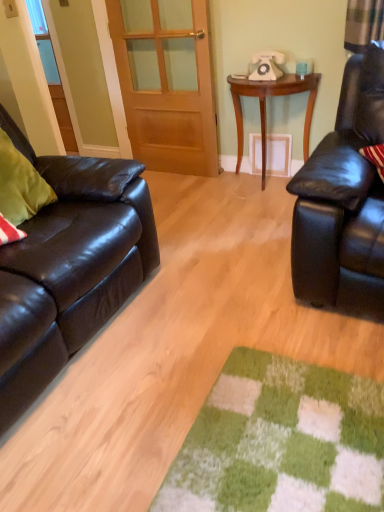
Question: Looking at their shapes, would you say shiny black leather couch at left is wider or thinner than wooden door at center?

Choices:
 (A) thin
 (B) wide

Answer: (B)

Question: Is shiny black leather couch at left taller or shorter than wooden door at center?

Choices:
 (A) tall
 (B) short

Answer: (B)

Question: Estimate the real-world distances between objects in this image. Which object is closer to the wooden table at center?

Choices:
 (A) wooden door at center
 (B) shiny black leather couch at left
 (C) matte black leather couch at left
 (D) white plastic telephone at upper center

Answer: (D)

Question: Which is nearer to the matte black leather couch at left?

Choices:
 (A) shiny black leather couch at left
 (B) wooden door at center
 (C) white plastic telephone at upper center
 (D) wooden table at center

Answer: (A)